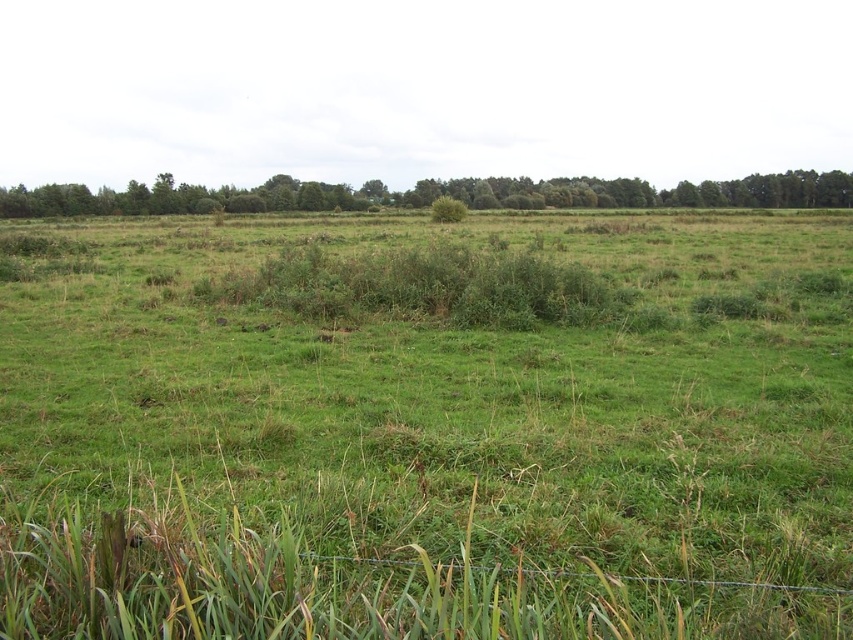
You are standing at the origin point in the image. Which direction should you move to reach the green grassy pasture at center?

The green grassy pasture at center is located at point 0.670 in the x coordinate and 0.501 in the y coordinate, so you should move towards the right direction to reach it since the x coordinate is higher than 0.5.

You are standing in the open field and want to walk towards the green leafy trees at upper center. Which direction should you head relative to the green grassy pasture at center?

You should head to the left side of the green grassy pasture at center because the green leafy trees at upper center are positioned on the left side of it.